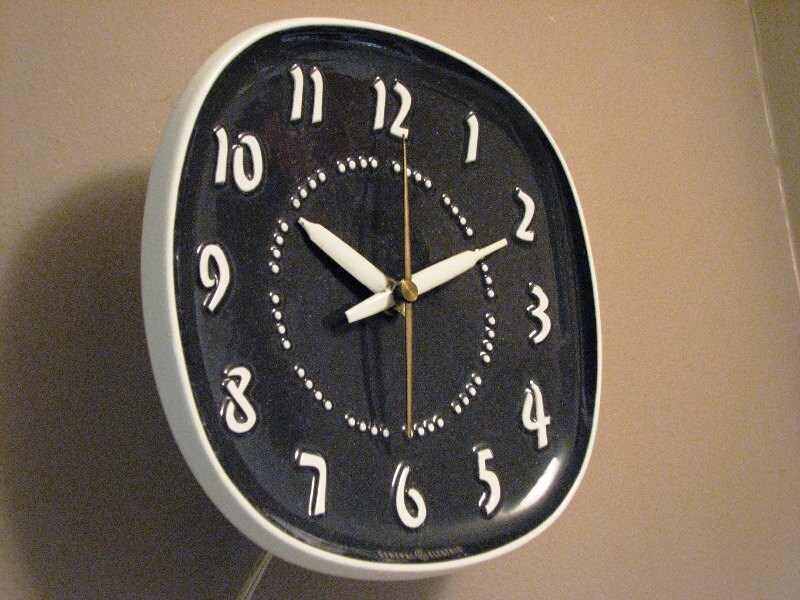
Where is `clock shadow`? The height and width of the screenshot is (600, 800). clock shadow is located at coordinates (56, 362).